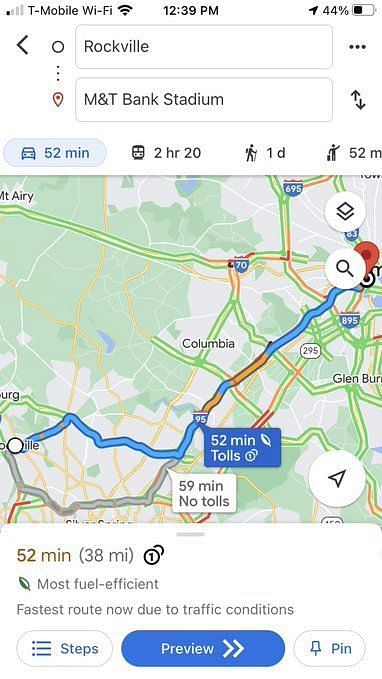
Where is `time display`? time display is located at coordinates (172, 9).